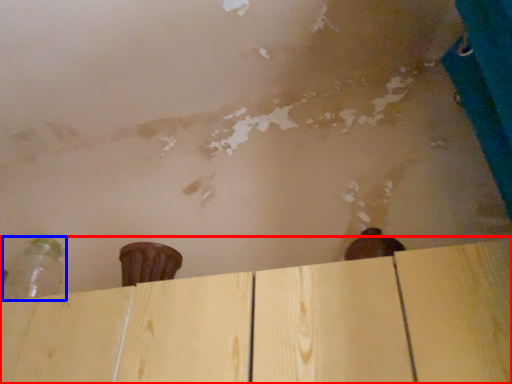
Question: Which of the following is the farthest to the observer, plywood (highlighted by a red box) or bottle (highlighted by a blue box)?

Choices:
 (A) plywood
 (B) bottle

Answer: (B)